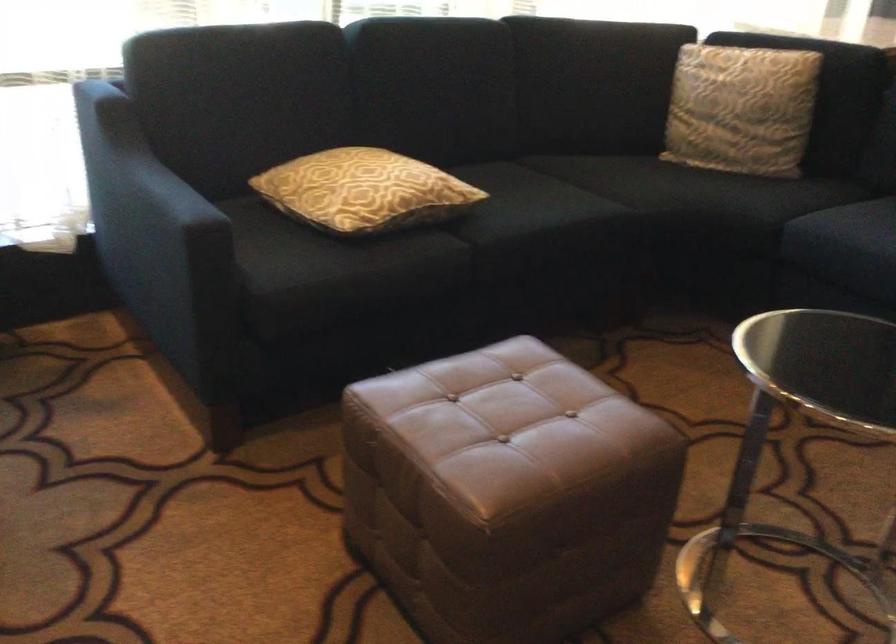
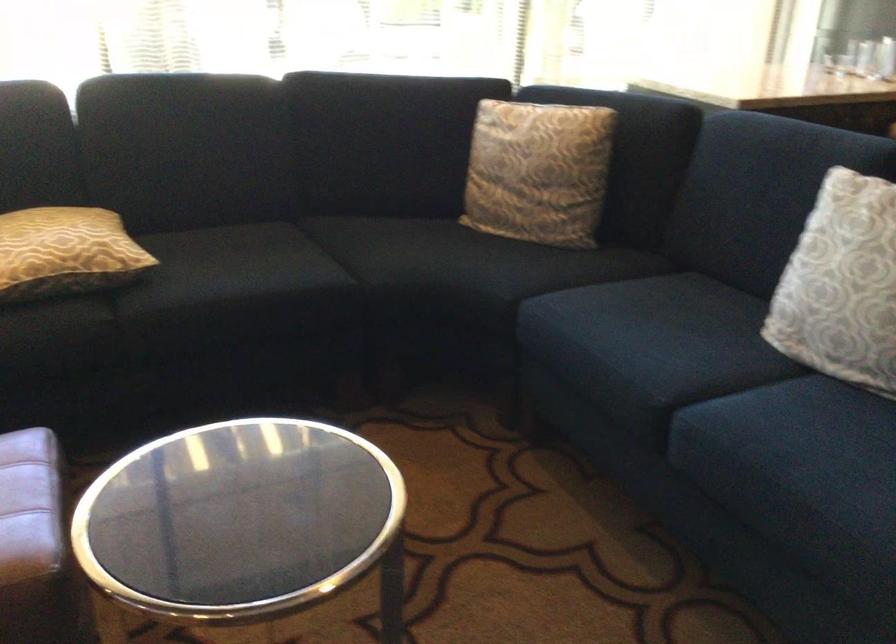
In the second image, find the point that corresponds to point 641,190 in the first image.

(391, 261)